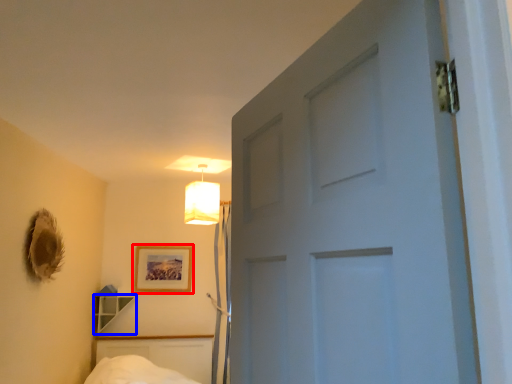
Question: Which of the following is the closest to the observer, picture frame (highlighted by a red box) or shelf (highlighted by a blue box)?

Choices:
 (A) picture frame
 (B) shelf

Answer: (B)